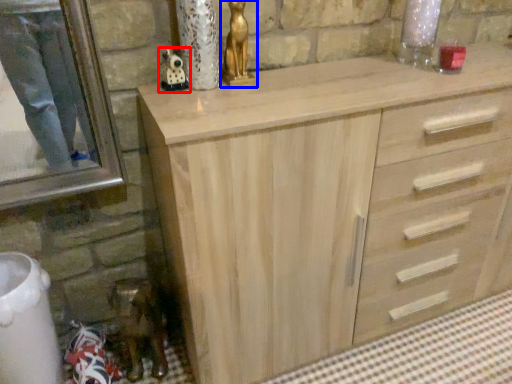
Question: Which point is further to the camera, miniature (highlighted by a red box) or sculpture (highlighted by a blue box)?

Choices:
 (A) miniature
 (B) sculpture

Answer: (A)